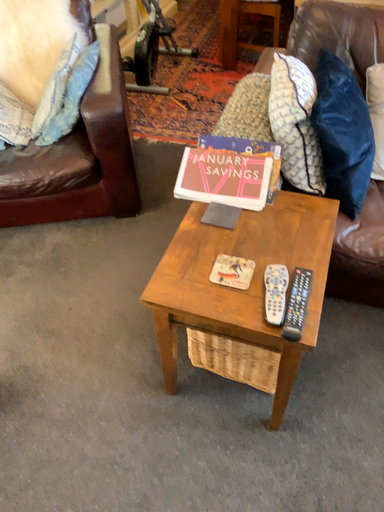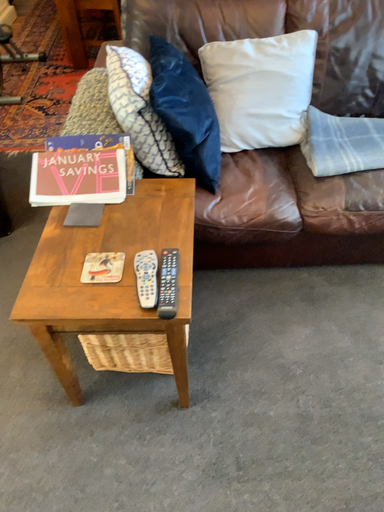
Question: Which way did the camera rotate in the video?

Choices:
 (A) rotated right
 (B) rotated left

Answer: (A)